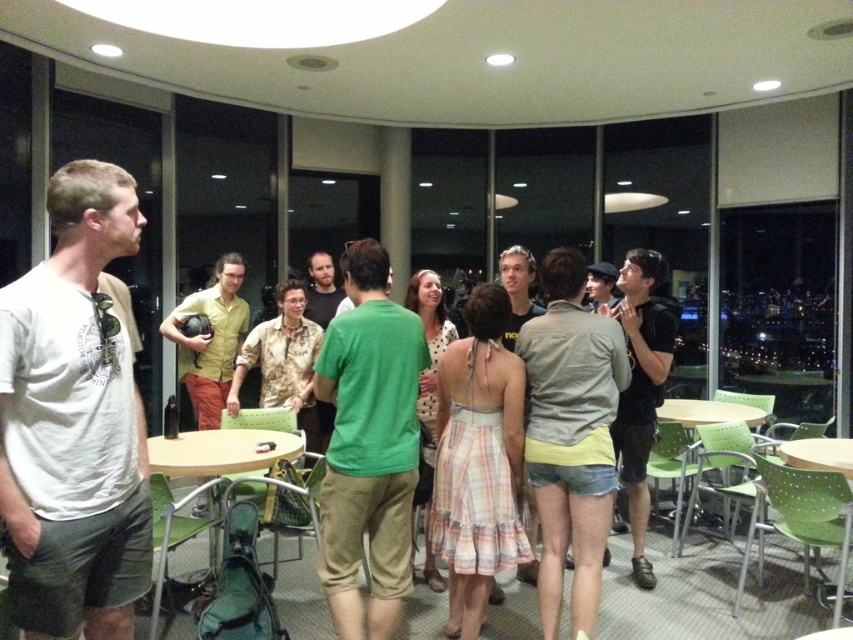
You are at the party and want to move from the wooden table at center to the green plastic table at lower right. Which direction should you move to reach it?

You should move to the right because the wooden table at center is to the left of the green plastic table at lower right.